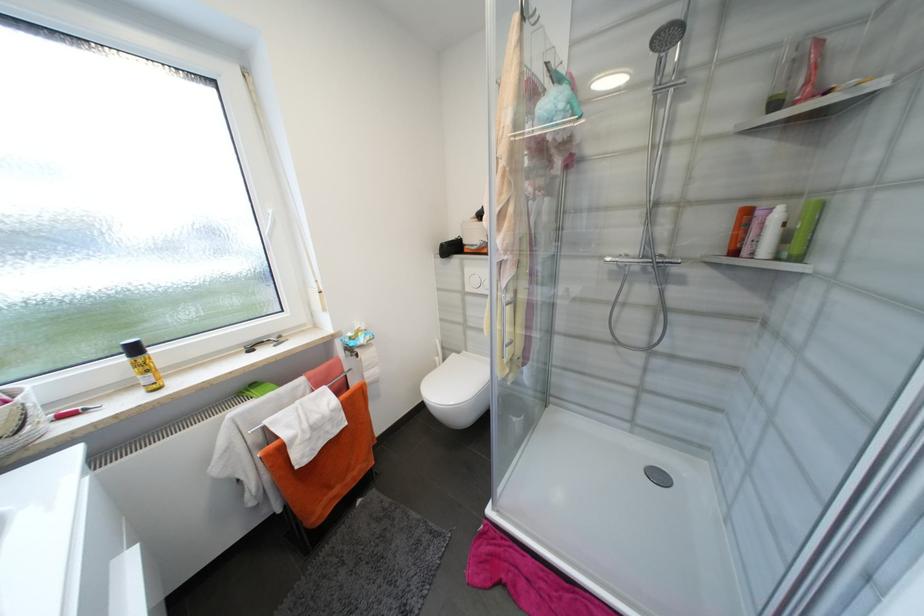
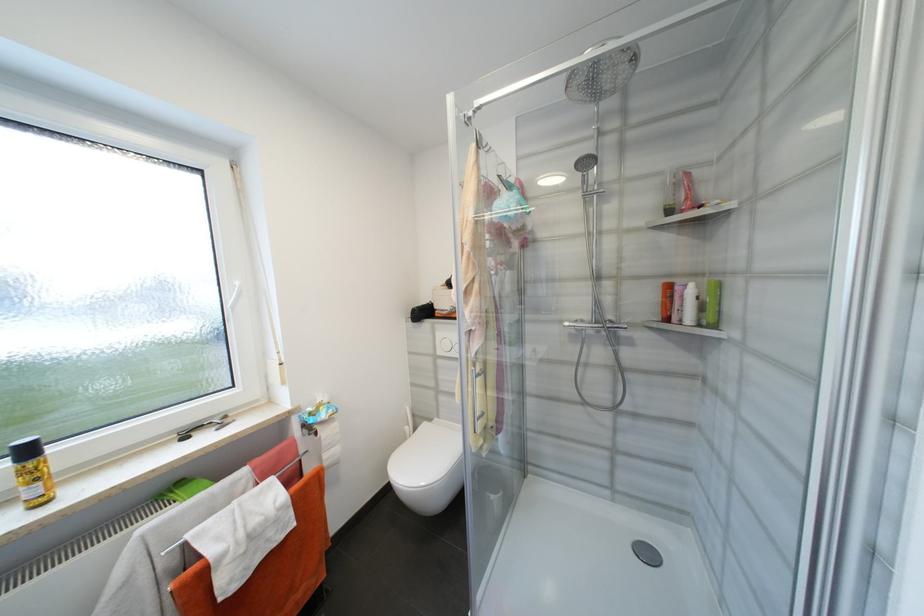
In the second image, find the point that corresponds to (614,261) in the first image.

(573, 325)